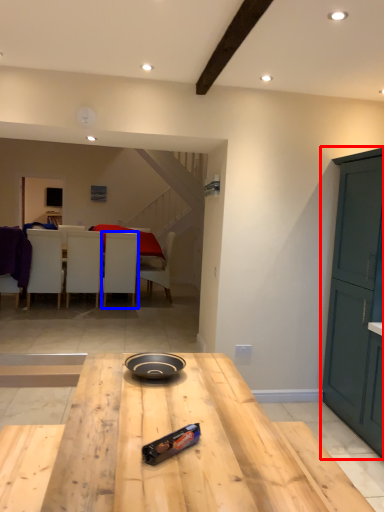
Question: Which of the following is the closest to the observer, cabinetry (highlighted by a red box) or chair (highlighted by a blue box)?

Choices:
 (A) cabinetry
 (B) chair

Answer: (A)